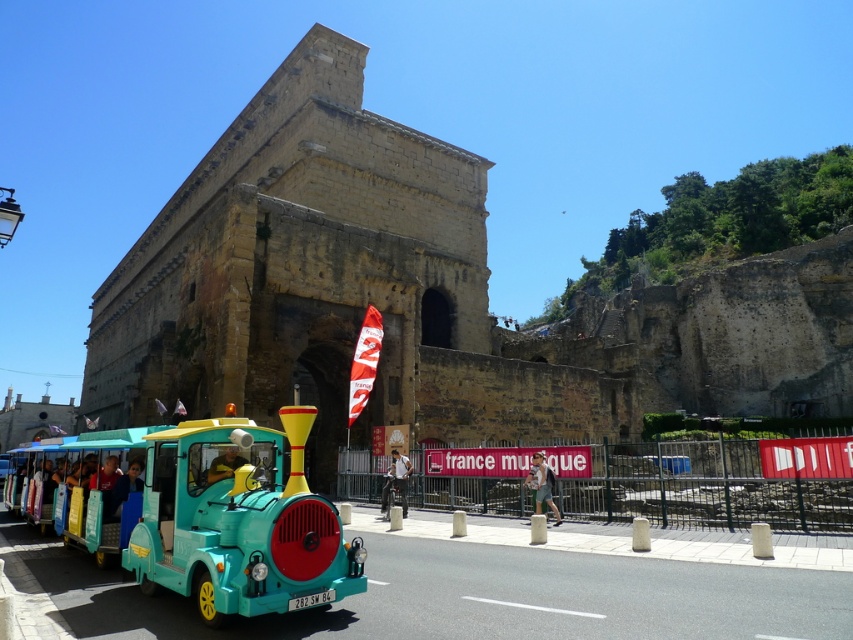
Locate an element on the screen. Image resolution: width=853 pixels, height=640 pixels. light blue fabric bicycle at center is located at coordinates (396, 481).

Can you confirm if light blue fabric bicycle at center is positioned above green fabric shirt at center?

Actually, light blue fabric bicycle at center is below green fabric shirt at center.

Does point (403, 502) come behind point (546, 484)?

Yes, point (403, 502) is behind point (546, 484).

The image size is (853, 640). What are the coordinates of `light blue fabric bicycle at center` in the screenshot? It's located at (396, 481).

Who is more forward, (538, 492) or (225, 468)?

Positioned in front is point (225, 468).

Locate an element on the screen. green fabric shirt at center is located at coordinates (541, 484).

Where is `green fabric shirt at center`? The height and width of the screenshot is (640, 853). green fabric shirt at center is located at coordinates (541, 484).

Does light blue fabric bicycle at center have a lesser width compared to yellow fabric person at center?

Correct, light blue fabric bicycle at center's width is less than yellow fabric person at center's.

Which is behind, point (393, 481) or point (225, 458)?

The point (393, 481) is more distant.

Who is more distant from viewer, (405, 490) or (212, 470)?

The point (405, 490) is more distant.

Identify the location of light blue fabric bicycle at center. The height and width of the screenshot is (640, 853). (396, 481).